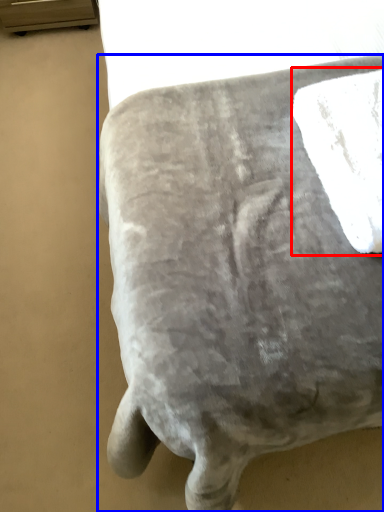
Question: Among these objects, which one is farthest to the camera, bath towel (highlighted by a red box) or furniture (highlighted by a blue box)?

Choices:
 (A) bath towel
 (B) furniture

Answer: (B)